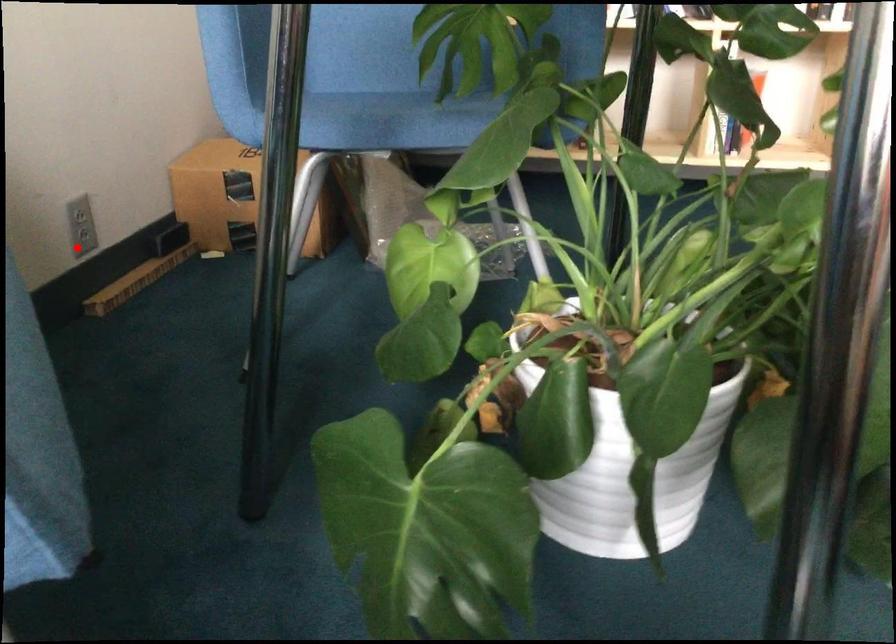
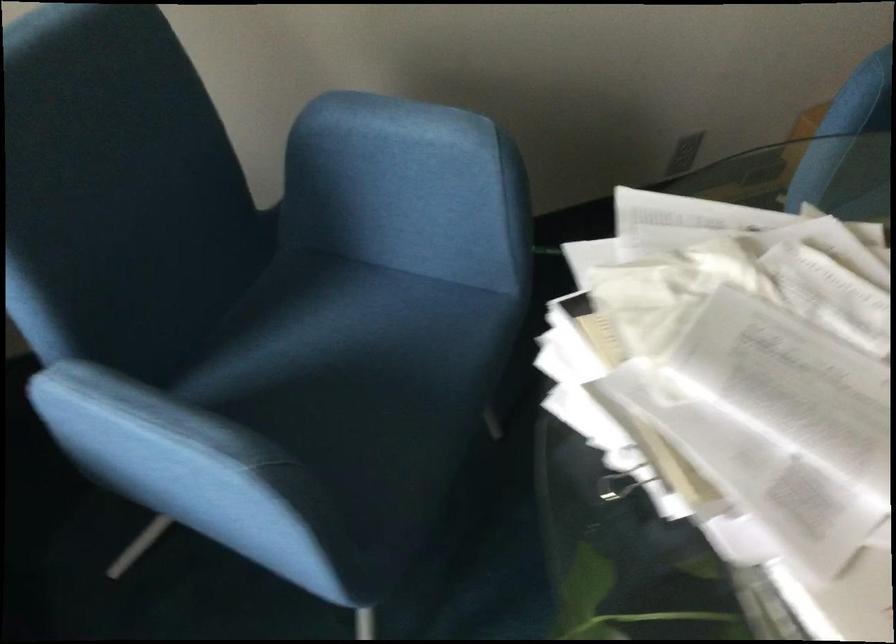
Question: I am providing you with two images of the same scene from different viewpoints. A red point is shown in image1. For the corresponding object point in image2, is it positioned nearer or farther from the camera?

Choices:
 (A) Nearer
 (B) Farther

Answer: (B)